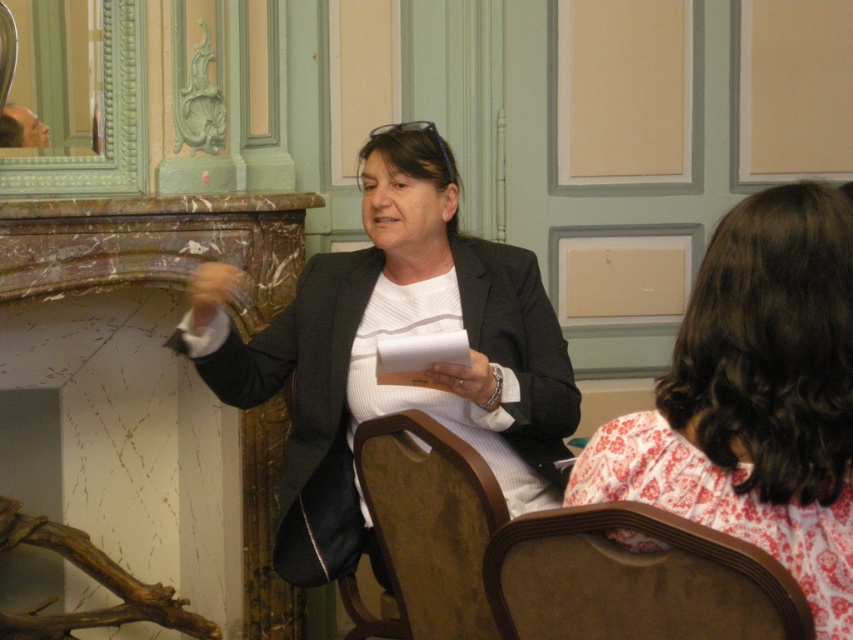
Question: Is matte black blazer at center wider than beige fabric armchair at lower right?

Choices:
 (A) no
 (B) yes

Answer: (B)

Question: Is matte black blazer at center thinner than white floral dress at center?

Choices:
 (A) yes
 (B) no

Answer: (B)

Question: Estimate the real-world distances between objects in this image. Which object is closer to the white floral dress at center?

Choices:
 (A) beige fabric armchair at lower right
 (B) brown wood chair at center

Answer: (A)

Question: Which of the following is the farthest from the observer?

Choices:
 (A) (701, 598)
 (B) (461, 518)

Answer: (B)

Question: Which point appears closest to the camera in this image?

Choices:
 (A) (514, 481)
 (B) (665, 609)
 (C) (373, 451)

Answer: (B)

Question: Does white floral dress at center have a larger size compared to brown wood chair at center?

Choices:
 (A) no
 (B) yes

Answer: (B)